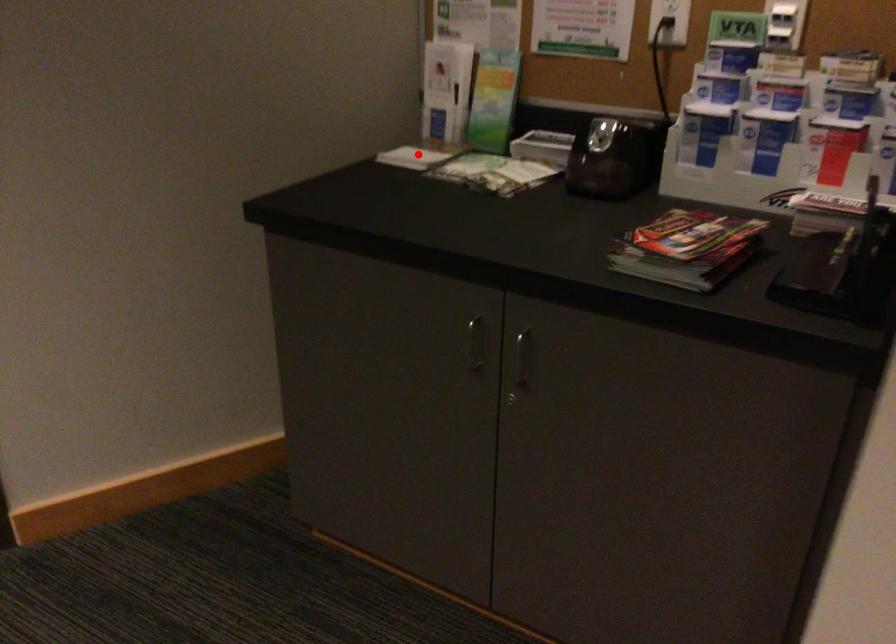
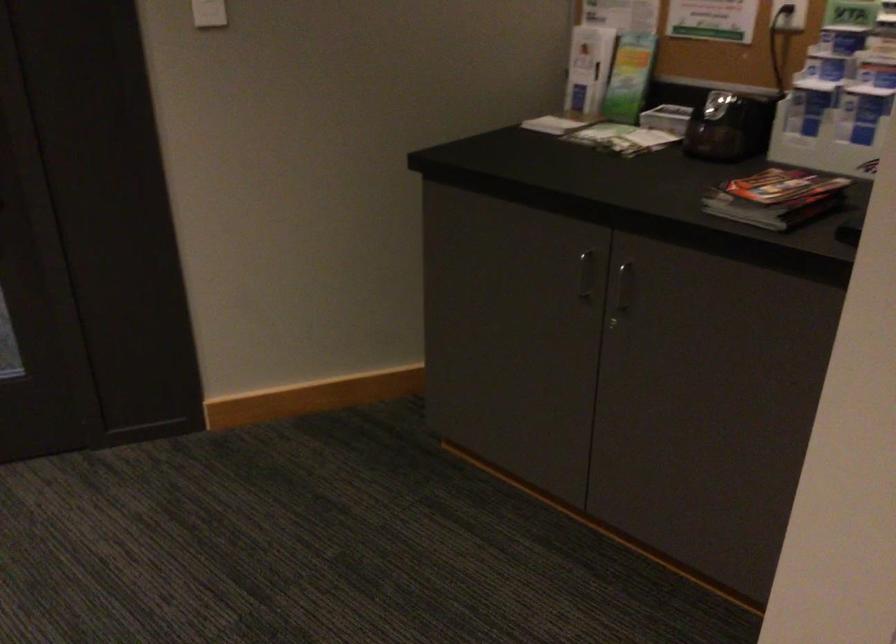
Locate, in the second image, the point that corresponds to the highlighted location in the first image.

(556, 122)